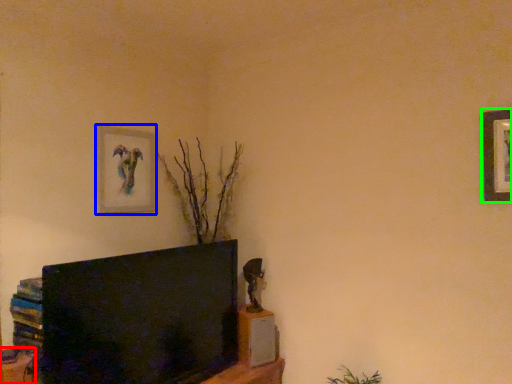
Question: Which object is positioned closest to furniture (highlighted by a red box)? Select from picture frame (highlighted by a blue box) and picture frame (highlighted by a green box).

Choices:
 (A) picture frame
 (B) picture frame

Answer: (A)